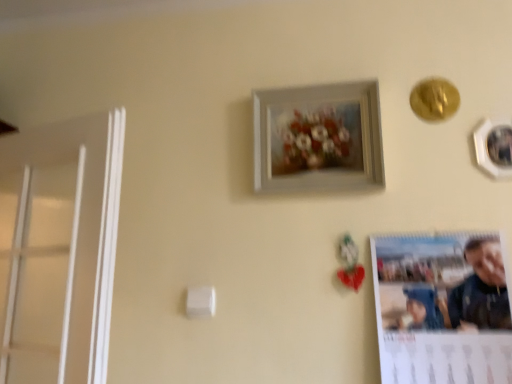
Describe the element at coordinates (318, 137) in the screenshot. I see `white matte picture frame at upper center, acting as the 2th picture frame starting from the right` at that location.

Describe the element at coordinates (494, 148) in the screenshot. The height and width of the screenshot is (384, 512). I see `white glossy picture frame at upper right, the 2th picture frame from the left` at that location.

Identify the location of white matte picture frame at upper center, the first picture frame in the left-to-right sequence. (318, 137).

Would you say matte paper calendar at lower right is part of white glossy picture frame at upper right, placed as the first picture frame when sorted from right to left,'s contents?

No, matte paper calendar at lower right is located outside of white glossy picture frame at upper right, placed as the first picture frame when sorted from right to left.

Based on the photo, is white glossy picture frame at upper right, placed as the first picture frame when sorted from right to left, aimed at matte paper calendar at lower right?

No.

From their relative heights in the image, would you say white glossy picture frame at upper right, the 2th picture frame from the left, is taller or shorter than matte paper calendar at lower right?

In the image, white glossy picture frame at upper right, the 2th picture frame from the left, appears to be shorter than matte paper calendar at lower right.

How different are the orientations of white glossy picture frame at upper right, the 2th picture frame from the left, and matte paper calendar at lower right in degrees?

The facing directions of white glossy picture frame at upper right, the 2th picture frame from the left, and matte paper calendar at lower right are 0.00536 degrees apart.

What's the angular difference between white glossy picture frame at upper right, placed as the first picture frame when sorted from right to left, and white matte picture frame at upper center, acting as the 2th picture frame starting from the right,'s facing directions?

The facing directions of white glossy picture frame at upper right, placed as the first picture frame when sorted from right to left, and white matte picture frame at upper center, acting as the 2th picture frame starting from the right, are 1.9 degrees apart.

From the image's perspective, which one is positioned higher, white glossy picture frame at upper right, placed as the first picture frame when sorted from right to left, or white matte picture frame at upper center, acting as the 2th picture frame starting from the right?

From the image's view, white matte picture frame at upper center, acting as the 2th picture frame starting from the right, is above.

Is white glossy picture frame at upper right, placed as the first picture frame when sorted from right to left, bigger or smaller than white matte picture frame at upper center, the first picture frame in the left-to-right sequence?

Considering their sizes, white glossy picture frame at upper right, placed as the first picture frame when sorted from right to left, takes up less space than white matte picture frame at upper center, the first picture frame in the left-to-right sequence.

From a real-world perspective, between white glossy picture frame at upper right, placed as the first picture frame when sorted from right to left, and white matte picture frame at upper center, the first picture frame in the left-to-right sequence, who is vertically higher?

A: In real-world perspective, white matte picture frame at upper center, the first picture frame in the left-to-right sequence, is above.

Is matte paper calendar at lower right oriented away from white matte picture frame at upper center, acting as the 2th picture frame starting from the right?

That's not correct — matte paper calendar at lower right is not looking away from white matte picture frame at upper center, acting as the 2th picture frame starting from the right.

From the image's perspective, which object appears higher, matte paper calendar at lower right or white matte picture frame at upper center, the first picture frame in the left-to-right sequence?

From the image's view, white matte picture frame at upper center, the first picture frame in the left-to-right sequence, is above.

Which of these two, matte paper calendar at lower right or white matte picture frame at upper center, acting as the 2th picture frame starting from the right, is thinner?

Thinner between the two is matte paper calendar at lower right.

Would you say matte paper calendar at lower right is outside white matte picture frame at upper center, the first picture frame in the left-to-right sequence?

Yes, matte paper calendar at lower right is not within white matte picture frame at upper center, the first picture frame in the left-to-right sequence.

Relative to white glossy picture frame at upper right, the 2th picture frame from the left, is matte paper calendar at lower right in front or behind?

matte paper calendar at lower right is positioned closer to the viewer than white glossy picture frame at upper right, the 2th picture frame from the left.

Which is behind, point (399, 272) or point (508, 122)?

Positioned behind is point (508, 122).

In terms of height, does matte paper calendar at lower right look taller or shorter compared to white glossy picture frame at upper right, the 2th picture frame from the left?

In the image, matte paper calendar at lower right appears to be taller than white glossy picture frame at upper right, the 2th picture frame from the left.

Between matte paper calendar at lower right and white glossy picture frame at upper right, the 2th picture frame from the left, which one has larger size?

Bigger between the two is matte paper calendar at lower right.

Which is more to the left, white matte picture frame at upper center, acting as the 2th picture frame starting from the right, or matte paper calendar at lower right?

Positioned to the left is white matte picture frame at upper center, acting as the 2th picture frame starting from the right.

Does white matte picture frame at upper center, acting as the 2th picture frame starting from the right, have a lesser width compared to matte paper calendar at lower right?

No, white matte picture frame at upper center, acting as the 2th picture frame starting from the right, is not thinner than matte paper calendar at lower right.

Which is closer, (354, 108) or (380, 330)?

Point (354, 108) is farther from the camera than point (380, 330).

Could you tell me if white matte picture frame at upper center, acting as the 2th picture frame starting from the right, is facing white glossy picture frame at upper right, placed as the first picture frame when sorted from right to left?

No.

Which point is more forward, (314, 171) or (497, 143)?

The point (497, 143) is more forward.

Consider the image. Is white matte picture frame at upper center, acting as the 2th picture frame starting from the right, bigger than white glossy picture frame at upper right, the 2th picture frame from the left?

Indeed, white matte picture frame at upper center, acting as the 2th picture frame starting from the right, has a larger size compared to white glossy picture frame at upper right, the 2th picture frame from the left.

Locate an element on the screen. This screenshot has width=512, height=384. picture frame lying above the white glossy picture frame at upper right, the 2th picture frame from the left (from the image's perspective) is located at coordinates (318, 137).

You are a GUI agent. You are given a task and a screenshot of the screen. Output one action in this format:
    pyautogui.click(x=<x>, y=<y>)
    Task: Click on the poster page directly beneath the white glossy picture frame at upper right, placed as the first picture frame when sorted from right to left (from a real-world perspective)
    Image resolution: width=512 pixels, height=384 pixels.
    Given the screenshot: What is the action you would take?
    pyautogui.click(x=442, y=308)

This screenshot has height=384, width=512. In order to click on picture frame positioned vertically above the white glossy picture frame at upper right, placed as the first picture frame when sorted from right to left (from a real-world perspective) in this screenshot , I will do click(318, 137).

Looking at the image, which one is located closer to matte paper calendar at lower right, white glossy picture frame at upper right, the 2th picture frame from the left, or white matte picture frame at upper center, acting as the 2th picture frame starting from the right?

The object closer to matte paper calendar at lower right is white matte picture frame at upper center, acting as the 2th picture frame starting from the right.

Based on their spatial positions, is matte paper calendar at lower right or white glossy picture frame at upper right, placed as the first picture frame when sorted from right to left, closer to white matte picture frame at upper center, the first picture frame in the left-to-right sequence?

matte paper calendar at lower right is positioned closer to the anchor white matte picture frame at upper center, the first picture frame in the left-to-right sequence.

Based on their spatial positions, is white glossy picture frame at upper right, the 2th picture frame from the left, or matte paper calendar at lower right further from white matte picture frame at upper center, acting as the 2th picture frame starting from the right?

Among the two, white glossy picture frame at upper right, the 2th picture frame from the left, is located further to white matte picture frame at upper center, acting as the 2th picture frame starting from the right.

Based on their spatial positions, is matte paper calendar at lower right or white matte picture frame at upper center, the first picture frame in the left-to-right sequence, further from white glossy picture frame at upper right, the 2th picture frame from the left?

Based on the image, white matte picture frame at upper center, the first picture frame in the left-to-right sequence, appears to be further to white glossy picture frame at upper right, the 2th picture frame from the left.

From the image, which object appears to be nearer to white glossy picture frame at upper right, the 2th picture frame from the left, white matte picture frame at upper center, acting as the 2th picture frame starting from the right, or matte paper calendar at lower right?

matte paper calendar at lower right is positioned closer to the anchor white glossy picture frame at upper right, the 2th picture frame from the left.

When comparing their distances from matte paper calendar at lower right, does white matte picture frame at upper center, acting as the 2th picture frame starting from the right, or white glossy picture frame at upper right, placed as the first picture frame when sorted from right to left, seem further?

Based on the image, white glossy picture frame at upper right, placed as the first picture frame when sorted from right to left, appears to be further to matte paper calendar at lower right.

This screenshot has width=512, height=384. In order to click on picture frame that lies between white matte picture frame at upper center, acting as the 2th picture frame starting from the right, and matte paper calendar at lower right from top to bottom in this screenshot , I will do `click(494, 148)`.